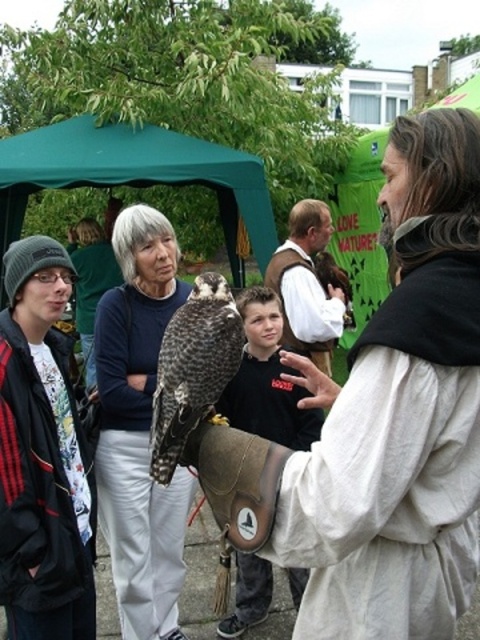
Question: Which point is farther from the camera taking this photo?

Choices:
 (A) (14, 342)
 (B) (6, 248)
 (C) (448, 465)
 (D) (294, 320)

Answer: (B)

Question: Which object is farther from the camera taking this photo?

Choices:
 (A) matte black jacket at center
 (B) white cotton robe at center

Answer: (A)

Question: Among these points, which one is farthest from the camera?

Choices:
 (A) (187, 161)
 (B) (120, 538)

Answer: (A)

Question: Where is white cotton robe at center located in relation to brown leather glove at center in the image?

Choices:
 (A) left
 (B) right

Answer: (B)

Question: Does matte black jacket at center appear on the left side of green fabric canopy at upper left?

Choices:
 (A) no
 (B) yes

Answer: (B)

Question: Can you confirm if matte black jacket at center is bigger than speckled feathered falcon at center?

Choices:
 (A) yes
 (B) no

Answer: (A)